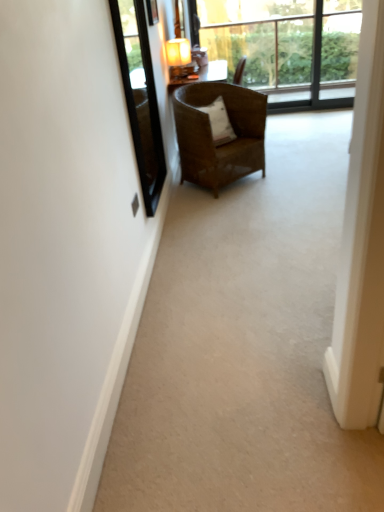
Locate an element on the screen. The height and width of the screenshot is (512, 384). vacant space in transparent glass window screen at upper left (from a real-world perspective) is located at coordinates (172, 223).